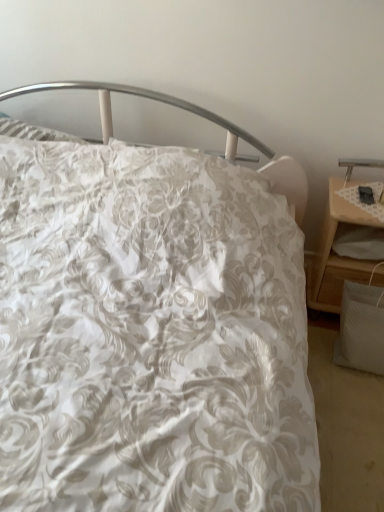
This screenshot has height=512, width=384. I want to click on vacant point above wooden nightstand at right (from a real-world perspective), so click(x=365, y=194).